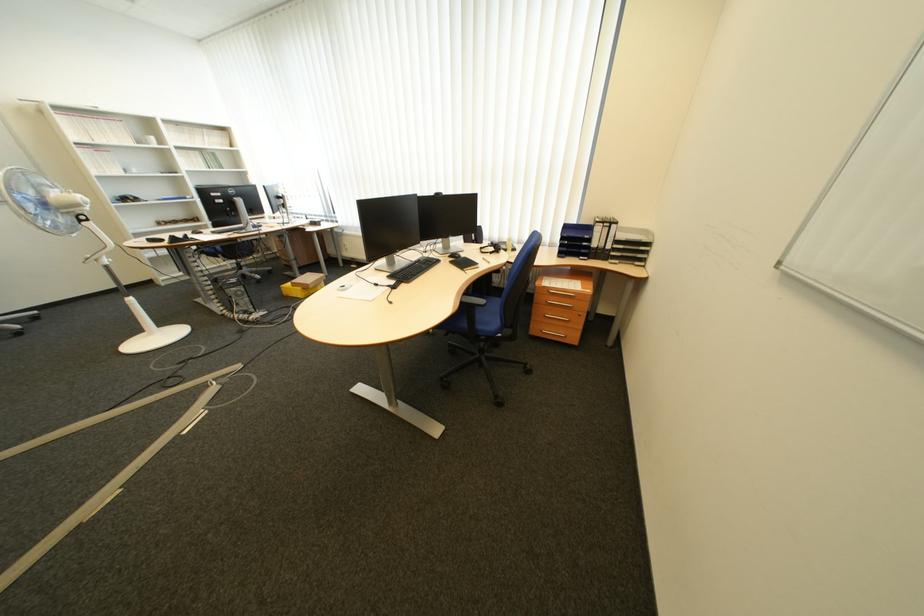
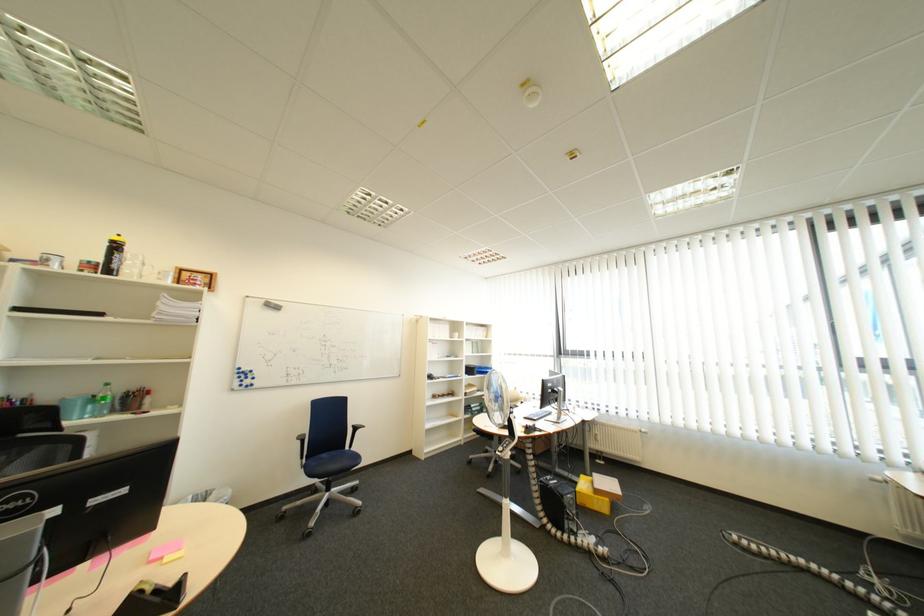
In the second image, find the point that corresponds to (219,241) in the first image.

(565, 434)